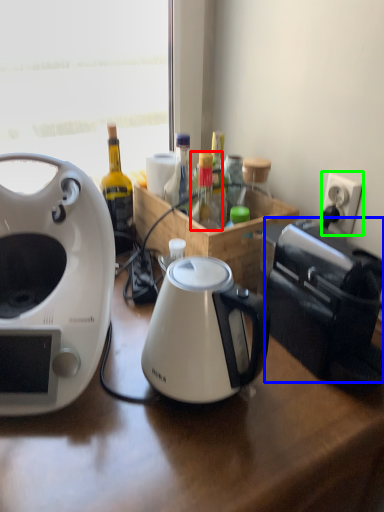
Question: Considering the real-world distances, which object is farthest from bottle (highlighted by a red box)? toaster (highlighted by a blue box) or power outlet (highlighted by a green box)?

Choices:
 (A) toaster
 (B) power outlet

Answer: (B)